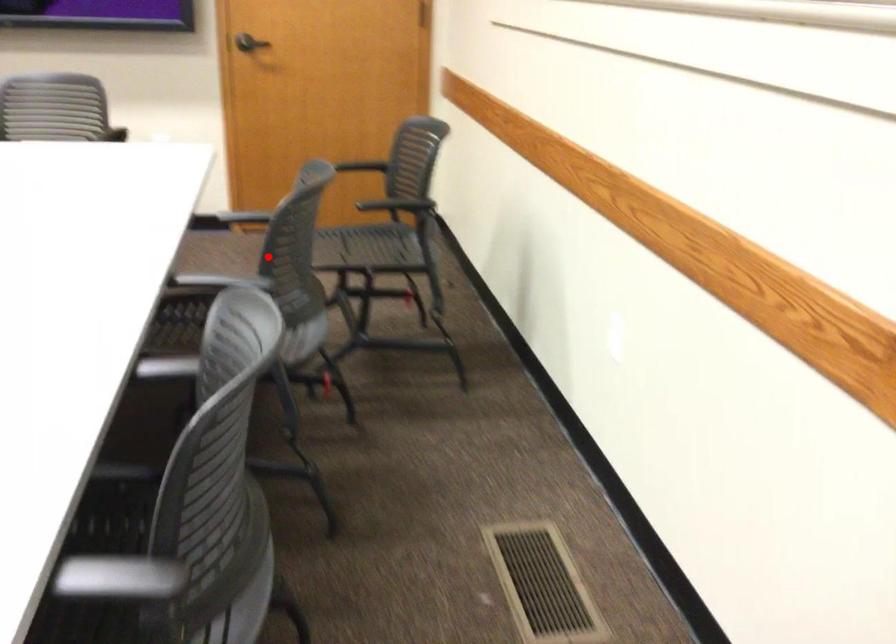
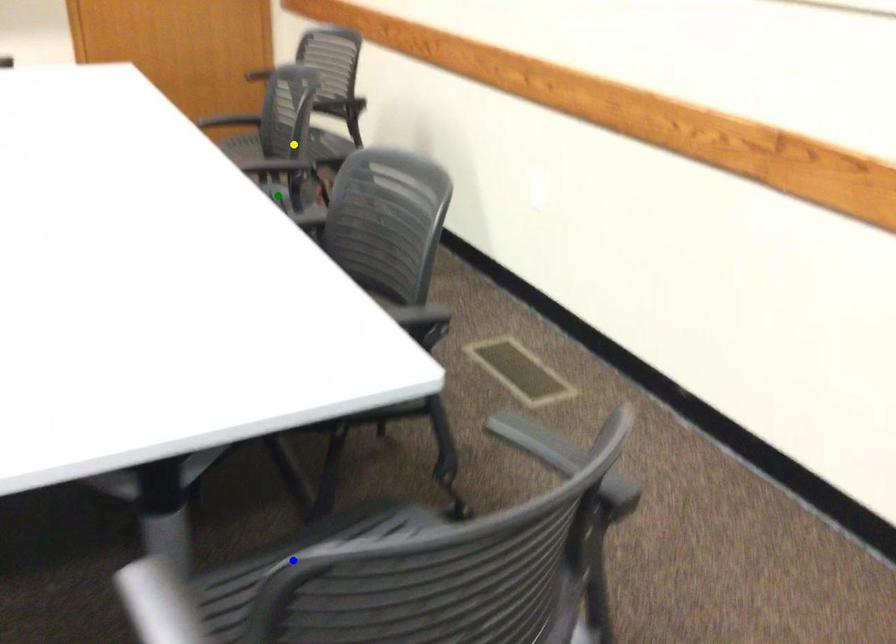
Question: I am providing you with two images of the same scene from different viewpoints. A red point is marked on the first image. You are given multiple points on the second image. Which point in image 2 represents the same 3d spot as the red point in image 1?

Choices:
 (A) blue point
 (B) yellow point
 (C) green point

Answer: (B)